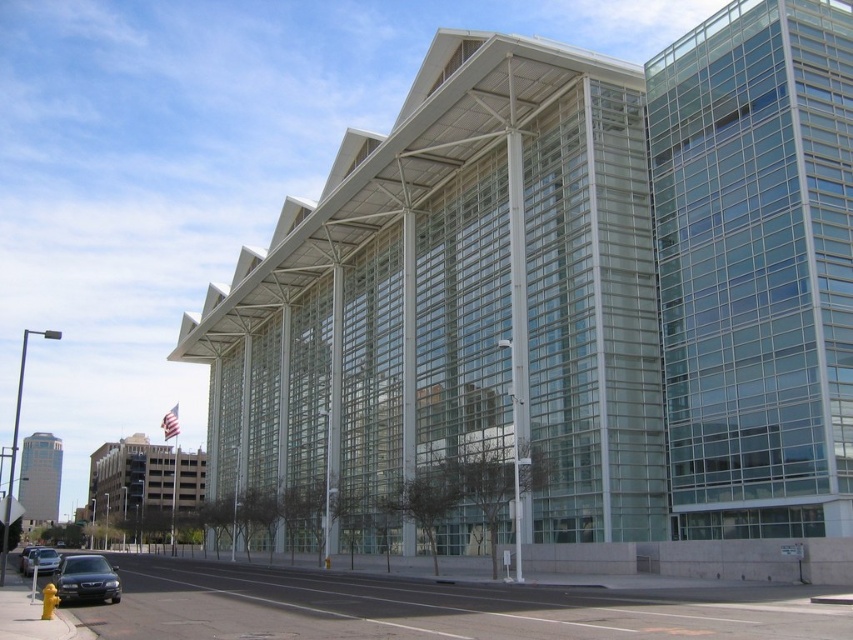
Who is taller, matte black sedan at lower left or shiny black sedan at lower left?

matte black sedan at lower left

Is matte black sedan at lower left closer to camera compared to shiny black sedan at lower left?

Yes, matte black sedan at lower left is closer to the viewer.

Image resolution: width=853 pixels, height=640 pixels. I want to click on matte black sedan at lower left, so click(x=86, y=579).